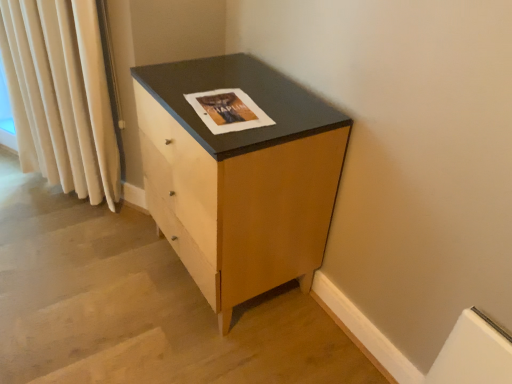
Question: Is matte paper magazine at center facing away from cream velvet curtain at left?

Choices:
 (A) no
 (B) yes

Answer: (A)

Question: Is matte paper magazine at center outside cream velvet curtain at left?

Choices:
 (A) yes
 (B) no

Answer: (A)

Question: Is matte paper magazine at center aimed at cream velvet curtain at left?

Choices:
 (A) no
 (B) yes

Answer: (A)

Question: Is matte paper magazine at center behind cream velvet curtain at left?

Choices:
 (A) yes
 (B) no

Answer: (B)

Question: Does matte paper magazine at center appear on the left side of cream velvet curtain at left?

Choices:
 (A) yes
 (B) no

Answer: (B)

Question: From the image's perspective, is matte wood chest of drawers at center above or below matte paper magazine at center?

Choices:
 (A) above
 (B) below

Answer: (B)

Question: Visually, is matte wood chest of drawers at center positioned to the left or to the right of matte paper magazine at center?

Choices:
 (A) right
 (B) left

Answer: (B)

Question: Would you say matte wood chest of drawers at center is inside or outside matte paper magazine at center?

Choices:
 (A) outside
 (B) inside

Answer: (A)

Question: Does point (175, 177) appear closer or farther from the camera than point (226, 109)?

Choices:
 (A) closer
 (B) farther

Answer: (B)

Question: Is cream velvet curtain at left in front of or behind matte paper magazine at center in the image?

Choices:
 (A) front
 (B) behind

Answer: (B)

Question: Is cream velvet curtain at left taller or shorter than matte paper magazine at center?

Choices:
 (A) tall
 (B) short

Answer: (A)

Question: Is cream velvet curtain at left bigger or smaller than matte paper magazine at center?

Choices:
 (A) small
 (B) big

Answer: (B)

Question: Looking at their shapes, would you say cream velvet curtain at left is wider or thinner than matte paper magazine at center?

Choices:
 (A) wide
 (B) thin

Answer: (B)

Question: Is cream velvet curtain at left taller or shorter than matte wood chest of drawers at center?

Choices:
 (A) tall
 (B) short

Answer: (A)

Question: Based on their sizes in the image, would you say cream velvet curtain at left is bigger or smaller than matte wood chest of drawers at center?

Choices:
 (A) small
 (B) big

Answer: (A)